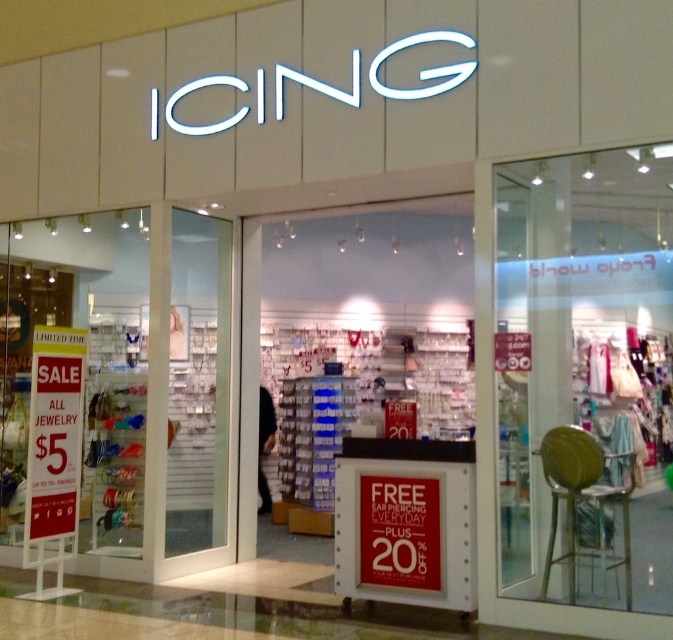
You are a customer standing outside the store. You want to sit on the transparent plastic stool at right while waiting for someone. Can you comfortably do so without touching the transparent glass door at center?

The transparent plastic stool at right is not as tall as the transparent glass door at center, so yes, you can comfortably sit on the transparent plastic stool at right without touching the transparent glass door at center.

You are standing at the entrance of the store and need to place a small package on the transparent plastic stool at right. Based on its position, can you confirm if the stool is near the entrance or further inside the store?

The transparent plastic stool at right is located at point (583, 374), which is closer to the entrance, so the stool is near the entrance.